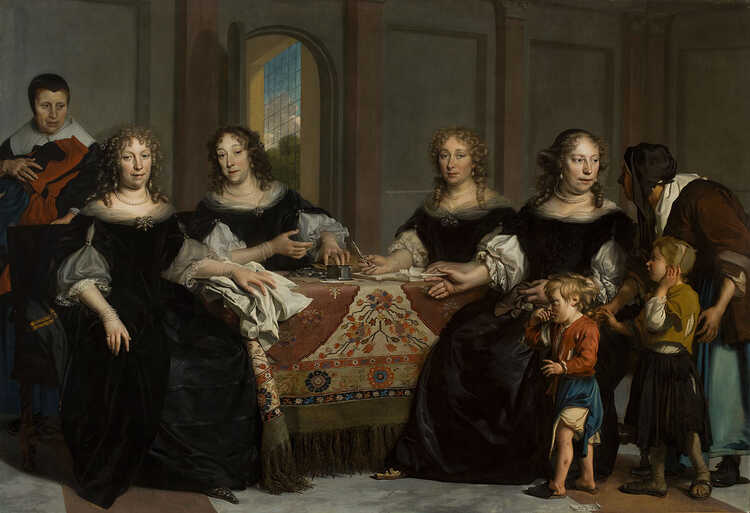
This screenshot has width=750, height=513. I want to click on cloth fringe, so click(x=285, y=467), click(x=340, y=459), click(x=392, y=440).